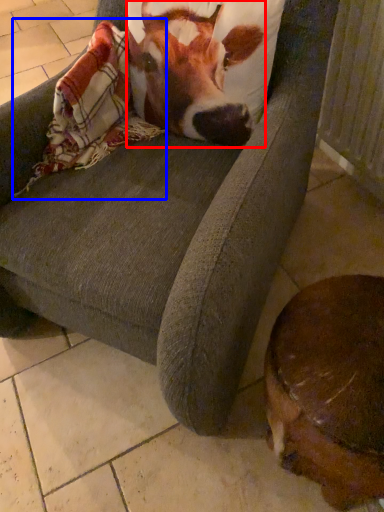
Question: Which object appears closest to the camera in this image, cattle (highlighted by a red box) or blanket (highlighted by a blue box)?

Choices:
 (A) cattle
 (B) blanket

Answer: (A)